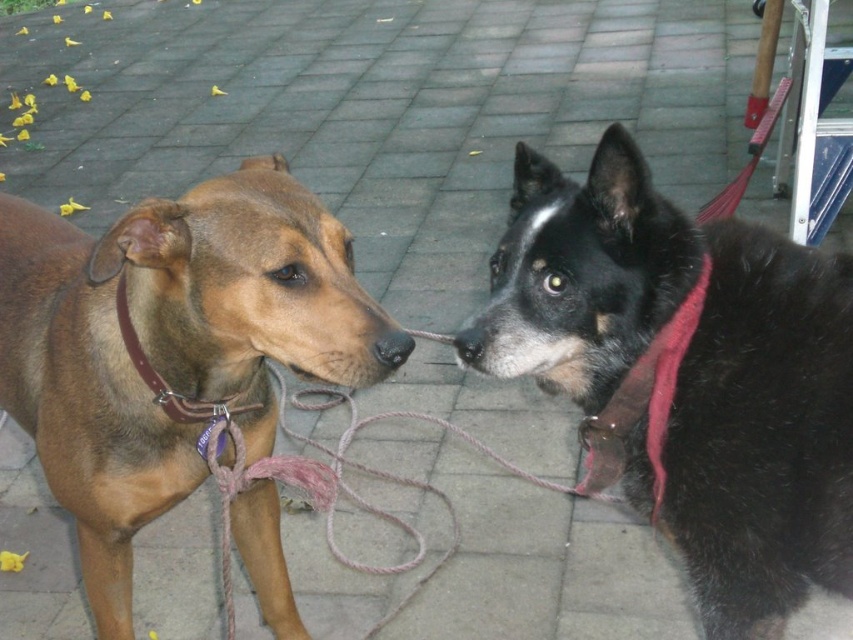
Looking at this image, you are a dog owner who wants to untangle the leash. Based on the image, which object is closer to you when you look at the black fur dog at center and the red fabric neckband at right?

The black fur dog at center is closer to you because it is positioned over the red fabric neckband at right.

You are standing at the point with coordinates point (134, 436) and want to walk towards the point with coordinates point (799, 416). Which direction should you move?

You should move forward because point (799, 416) is in front of point (134, 436).